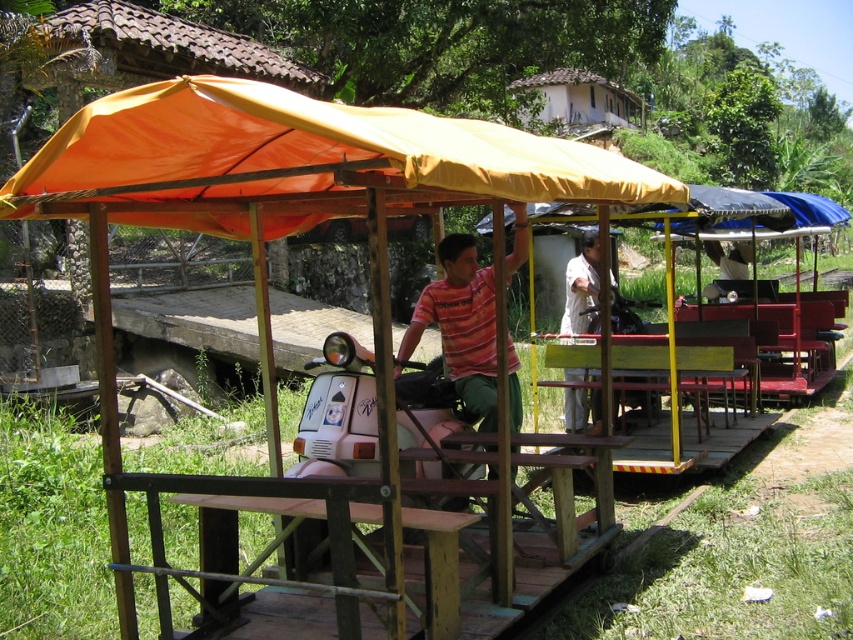
Question: Is orange fabric canopy at upper center above white matte shirt at center?

Choices:
 (A) no
 (B) yes

Answer: (B)

Question: Which point is closer to the camera?

Choices:
 (A) orange fabric canopy at upper center
 (B) white matte shirt at center

Answer: (A)

Question: Is the position of orange fabric canopy at upper center more distant than that of white matte shirt at center?

Choices:
 (A) no
 (B) yes

Answer: (A)

Question: Does orange fabric canopy at upper center appear over white matte shirt at center?

Choices:
 (A) no
 (B) yes

Answer: (B)